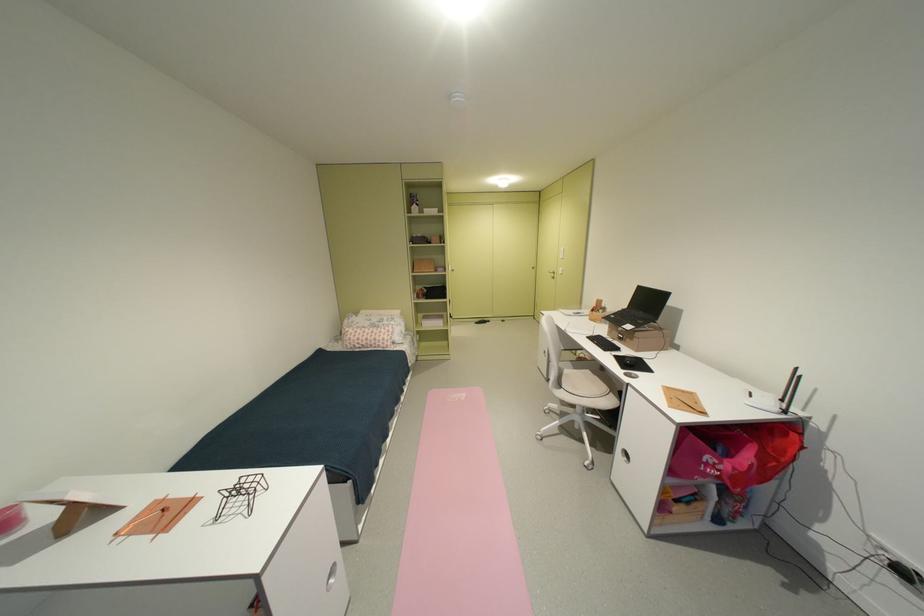
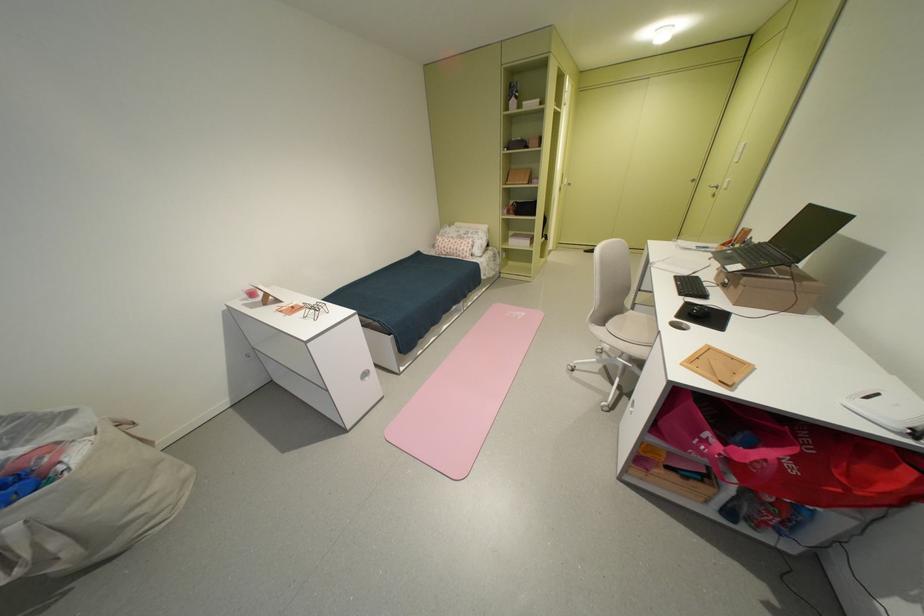
The point at (388, 342) is marked in the first image. Where is the corresponding point in the second image?

(468, 252)